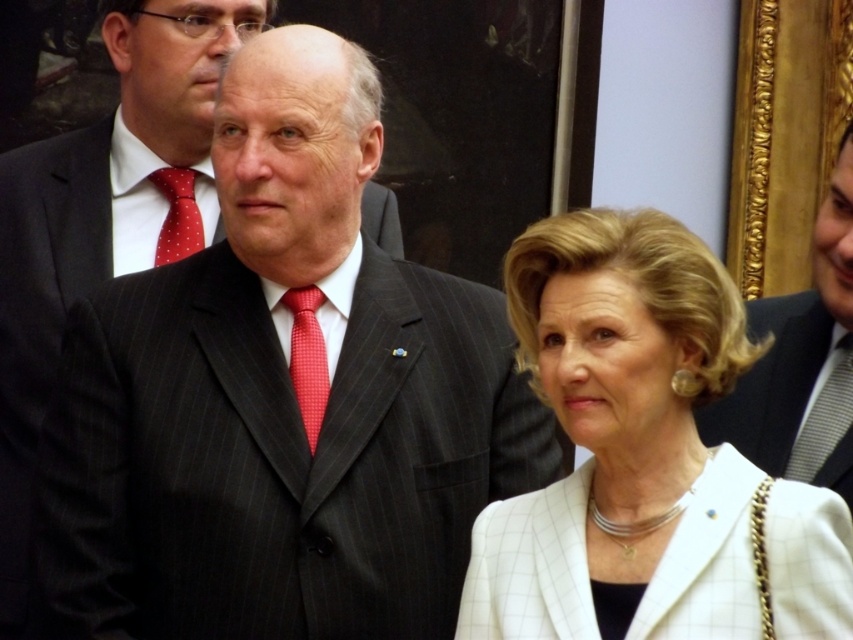
Does dark gray suit at center have a lesser height compared to red textured tie at center?

No, dark gray suit at center is not shorter than red textured tie at center.

Who is more forward, (815, 266) or (311, 452)?

Point (311, 452) is in front.

Does point (850, 376) come in front of point (300, 348)?

No, it is behind (300, 348).

The image size is (853, 640). I want to click on dark gray suit at center, so click(x=801, y=362).

Does red textured tie at center have a lesser width compared to gray striped tie at right?

Yes.

Can you confirm if red textured tie at center is positioned below gray striped tie at right?

Incorrect, red textured tie at center is not positioned below gray striped tie at right.

Between point (306, 360) and point (846, 372), which one is positioned behind?

Positioned behind is point (846, 372).

I want to click on red textured tie at center, so 306,358.

Where is `dark pinstripe suit at center`? dark pinstripe suit at center is located at coordinates (281, 401).

Is dark pinstripe suit at center taller than white textured blazer at center?

→ Correct, dark pinstripe suit at center is much taller as white textured blazer at center.

Is point (238, 120) positioned after point (529, 340)?

Yes, point (238, 120) is behind point (529, 340).

The height and width of the screenshot is (640, 853). I want to click on dark pinstripe suit at center, so click(281, 401).